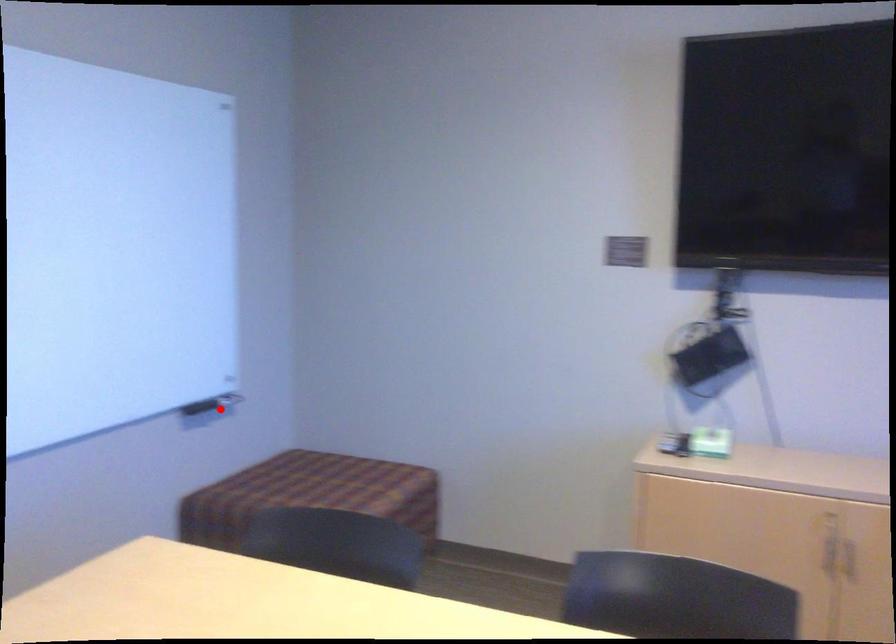
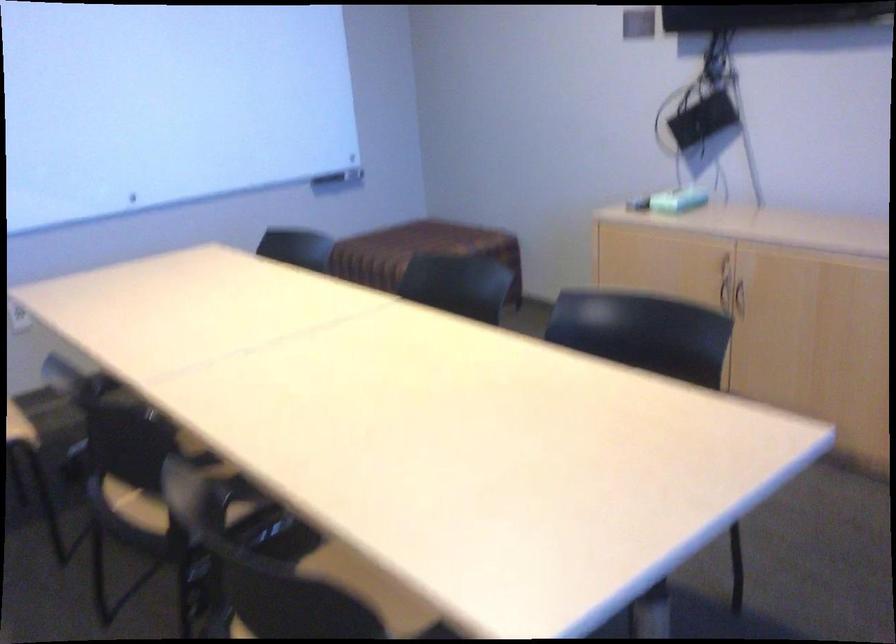
Question: I am providing you with two images of the same scene from different viewpoints. Given a red point in image1, look at the same physical point in image2. Is it:

Choices:
 (A) Closer to the viewpoint
 (B) Farther from the viewpoint

Answer: (B)